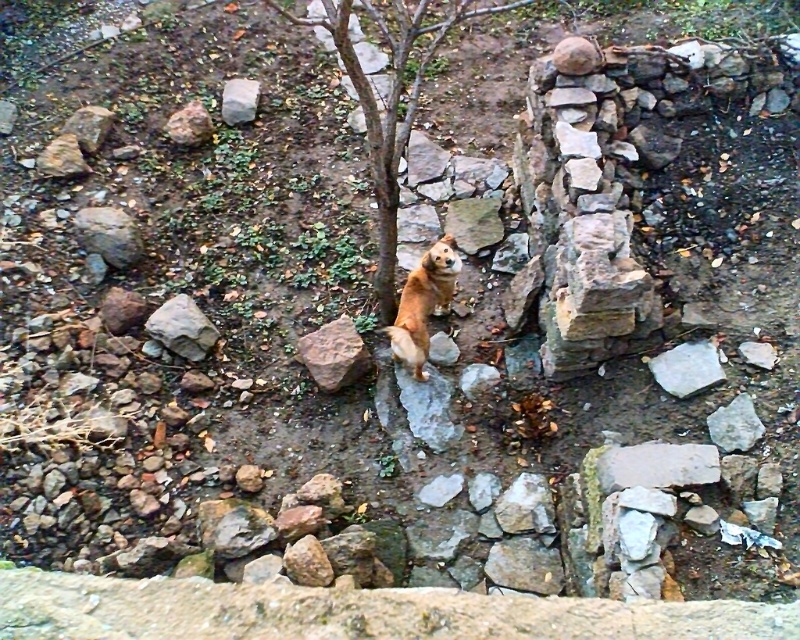
Which is more to the right, golden fur dog at center or smooth gray rock at upper left?

From the viewer's perspective, golden fur dog at center appears more on the right side.

Where is `golden fur dog at center`? The height and width of the screenshot is (640, 800). golden fur dog at center is located at coordinates (424, 304).

Where is `golden fur dog at center`? This screenshot has width=800, height=640. golden fur dog at center is located at coordinates (424, 304).

Is brown rough rock at center bigger than gray rough rock at left?

No.

Does brown rough rock at center come in front of gray rough rock at left?

Yes, brown rough rock at center is closer to the viewer.

Which is in front, point (350, 348) or point (120, 230)?

Point (350, 348) is more forward.

Find the location of a particular element. The image size is (800, 640). brown rough rock at center is located at coordinates point(333,355).

Is gray rough rock at left below gray rough rock at upper center?

Indeed, gray rough rock at left is positioned under gray rough rock at upper center.

Is gray rough rock at left above gray rough rock at upper center?

Incorrect, gray rough rock at left is not positioned above gray rough rock at upper center.

Locate an element on the screen. This screenshot has width=800, height=640. gray rough rock at left is located at coordinates (108, 234).

Where is `gray rough rock at left`? The width and height of the screenshot is (800, 640). gray rough rock at left is located at coordinates (108, 234).